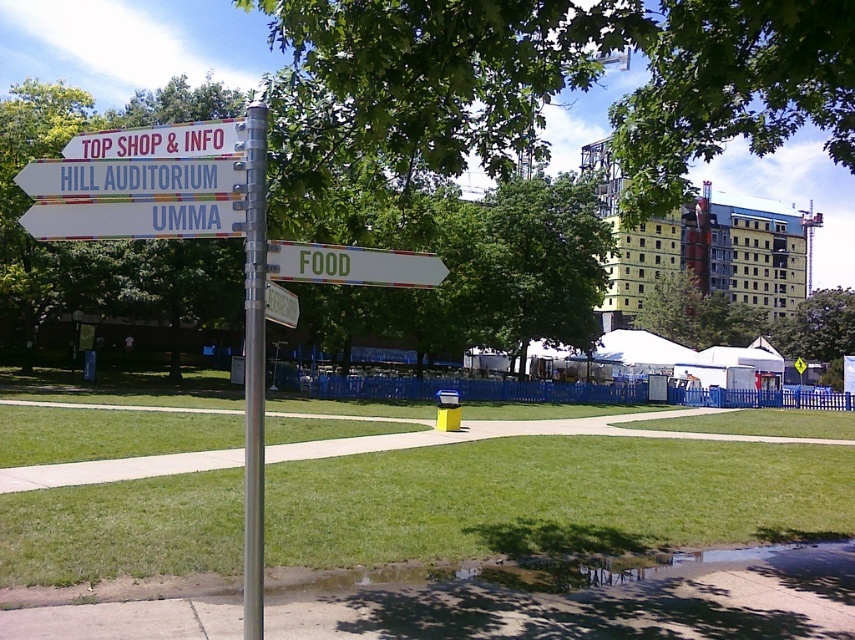
Question: Is silver metallic pole at center smaller than metallic silver sign at center?

Choices:
 (A) yes
 (B) no

Answer: (B)

Question: Which point appears closest to the camera in this image?

Choices:
 (A) (63, 180)
 (B) (104, 212)
 (C) (69, 145)

Answer: (B)

Question: Is silver metallic pole at center below metallic silver sign at center?

Choices:
 (A) yes
 (B) no

Answer: (A)

Question: Is white plastic sign at center bigger than white plastic sign at upper center?

Choices:
 (A) no
 (B) yes

Answer: (A)

Question: Which of the following is the farthest from the observer?

Choices:
 (A) metallic silver sign at center
 (B) white plastic sign at center

Answer: (A)

Question: Which object appears closest to the camera in this image?

Choices:
 (A) metallic silver sign at center
 (B) green grass at center
 (C) white plastic sign at upper left

Answer: (C)